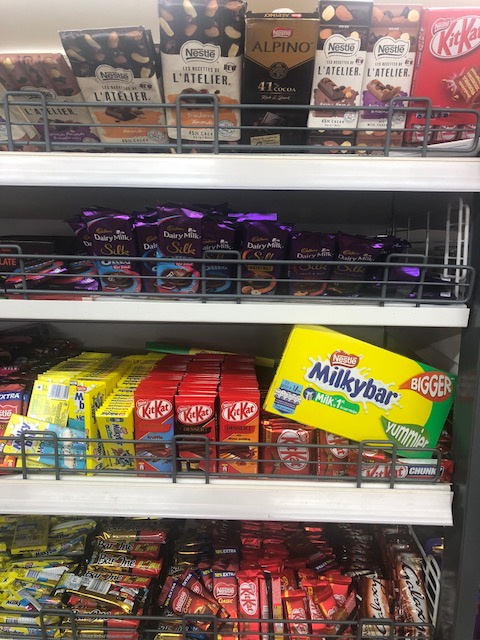
At what (x,y) coordinates should I click in order to perform the action: click on side wire rack. Please return your answer as a coordinate pair (x, y). The width and height of the screenshot is (480, 640). Looking at the image, I should click on (462, 236).